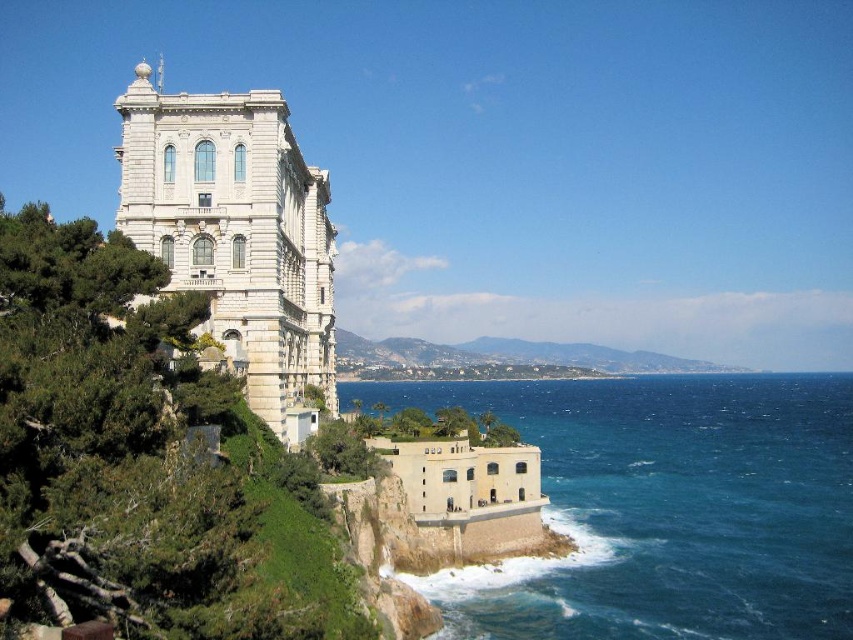
Between blue water at lower right and white stone building at upper left, which one is positioned higher?

white stone building at upper left is higher up.

Measure the distance from blue water at lower right to white stone building at upper left.

blue water at lower right and white stone building at upper left are 52.84 meters apart from each other.

Which is in front, point (747, 394) or point (291, 432)?

Point (291, 432) is more forward.

Identify the location of blue water at lower right. (665, 508).